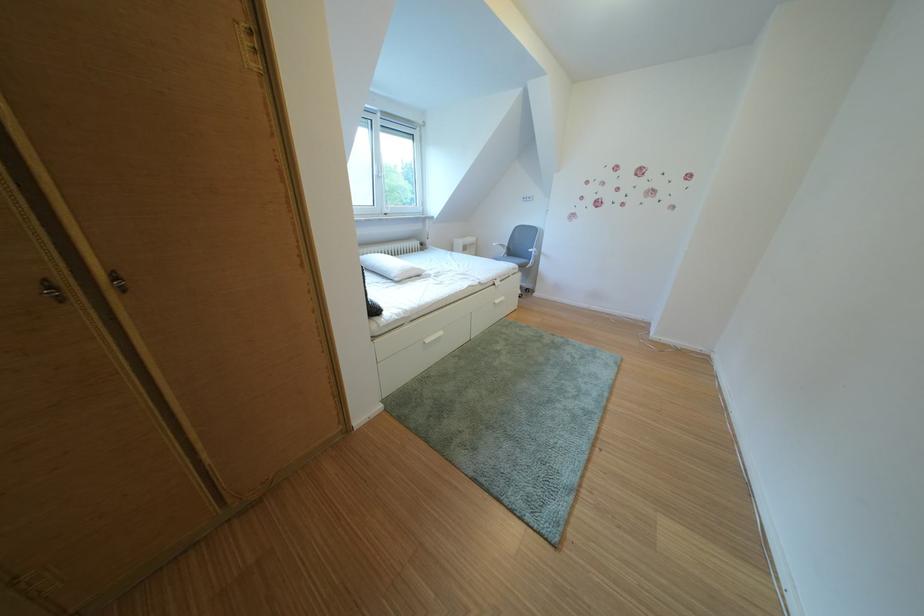
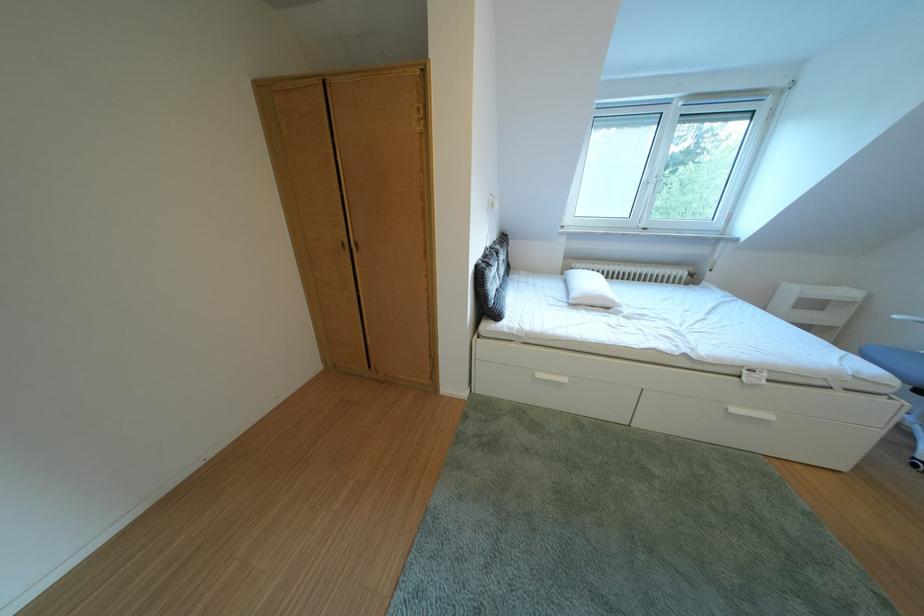
Where in the second image is the point corresponding to point 511,307 from the first image?

(748, 415)